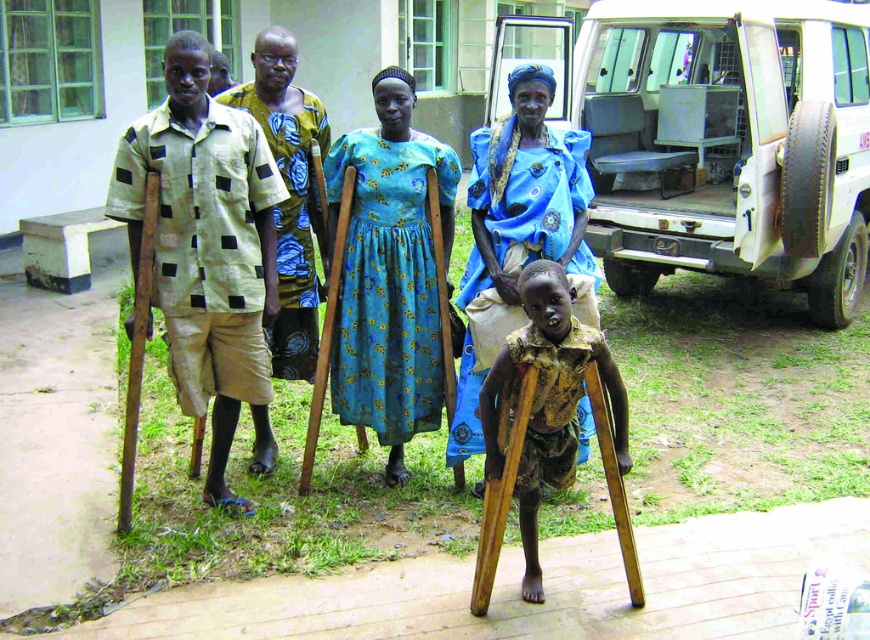
Question: Does wooden crutches at center appear under yellow-green printed shirt at center?

Choices:
 (A) yes
 (B) no

Answer: (A)

Question: Is wooden crutches at center bigger than yellow-green printed shirt at center?

Choices:
 (A) yes
 (B) no

Answer: (B)

Question: Which point is closer to the camera?

Choices:
 (A) (179, 301)
 (B) (300, 323)

Answer: (A)

Question: Among these points, which one is nearest to the camera?

Choices:
 (A) (563, 320)
 (B) (175, 76)

Answer: (A)

Question: Which of the following is the closest to the observer?

Choices:
 (A) (270, 460)
 (B) (494, 150)
 (C) (131, 189)

Answer: (C)

Question: Does wooden crutches at center appear under yellow-green printed shirt at center?

Choices:
 (A) no
 (B) yes

Answer: (B)